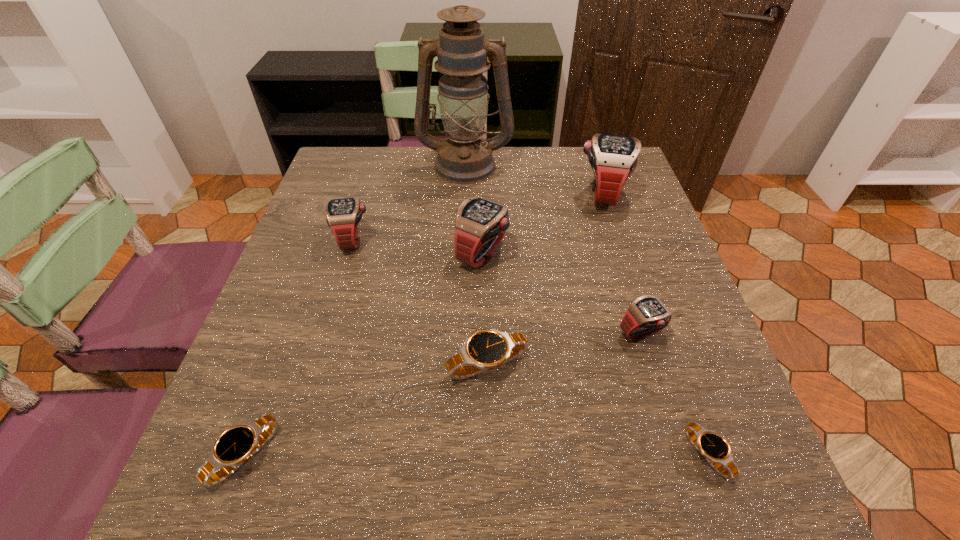
This screenshot has height=540, width=960. What are the coordinates of `vacant area situated 0.050m on the right of the fourth tallest watch` in the screenshot? It's located at [692, 334].

Where is `vacant space located on the left of the second black watch from left to right`? The width and height of the screenshot is (960, 540). vacant space located on the left of the second black watch from left to right is located at coordinates point(372,364).

This screenshot has width=960, height=540. Identify the location of free space located 0.390m on the right of the second smallest black watch. (529, 455).

Image resolution: width=960 pixels, height=540 pixels. In order to click on free location located 0.360m on the left of the rightmost black watch in this screenshot , I will do `click(453, 455)`.

Image resolution: width=960 pixels, height=540 pixels. I want to click on oil lamp positioned at the far edge, so click(464, 157).

Where is `watch that is at the far edge`? Image resolution: width=960 pixels, height=540 pixels. watch that is at the far edge is located at coordinates (613, 158).

At what (x,y) coordinates should I click in order to perform the action: click on object that is at the near left corner. Please return your answer as a coordinate pair (x, y). Image resolution: width=960 pixels, height=540 pixels. Looking at the image, I should click on (235, 446).

Find the location of a particular element. object located at the far right corner is located at coordinates (613, 158).

I want to click on object located at the near right corner, so click(713, 447).

Where is `free space at the far edge`? The height and width of the screenshot is (540, 960). free space at the far edge is located at coordinates (539, 178).